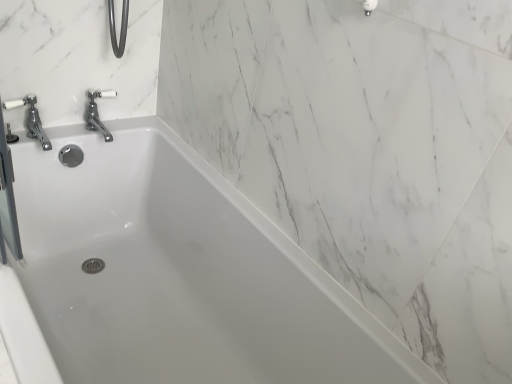
Question: In the image, is white glossy bathtub at center positioned in front of or behind chrome/polished metal faucet at upper left?

Choices:
 (A) behind
 (B) front

Answer: (B)

Question: Visually, is white glossy bathtub at center positioned to the left or to the right of chrome/polished metal faucet at upper left?

Choices:
 (A) left
 (B) right

Answer: (B)

Question: From the image's perspective, is white glossy bathtub at center above or below chrome/polished metal faucet at upper left?

Choices:
 (A) below
 (B) above

Answer: (A)

Question: Is point (35, 130) positioned closer to the camera than point (159, 274)?

Choices:
 (A) closer
 (B) farther

Answer: (A)

Question: From a real-world perspective, is chrome/polished metal faucet at upper left above or below white glossy bathtub at center?

Choices:
 (A) below
 (B) above

Answer: (B)

Question: Is chrome/polished metal faucet at upper left in front of or behind white glossy bathtub at center in the image?

Choices:
 (A) front
 (B) behind

Answer: (B)

Question: Considering the positions of chrome/polished metal faucet at upper left and white glossy bathtub at center in the image, is chrome/polished metal faucet at upper left wider or thinner than white glossy bathtub at center?

Choices:
 (A) thin
 (B) wide

Answer: (A)